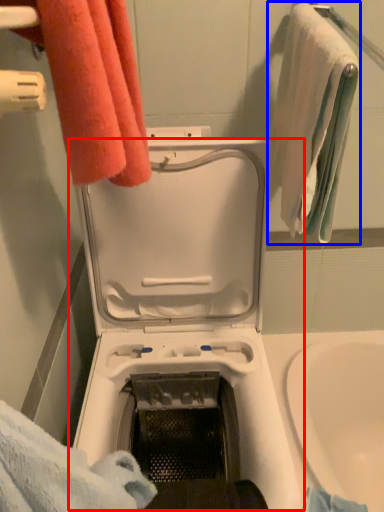
Question: Which object appears closest to the camera in this image, washing machine (highlighted by a red box) or towel (highlighted by a blue box)?

Choices:
 (A) washing machine
 (B) towel

Answer: (A)